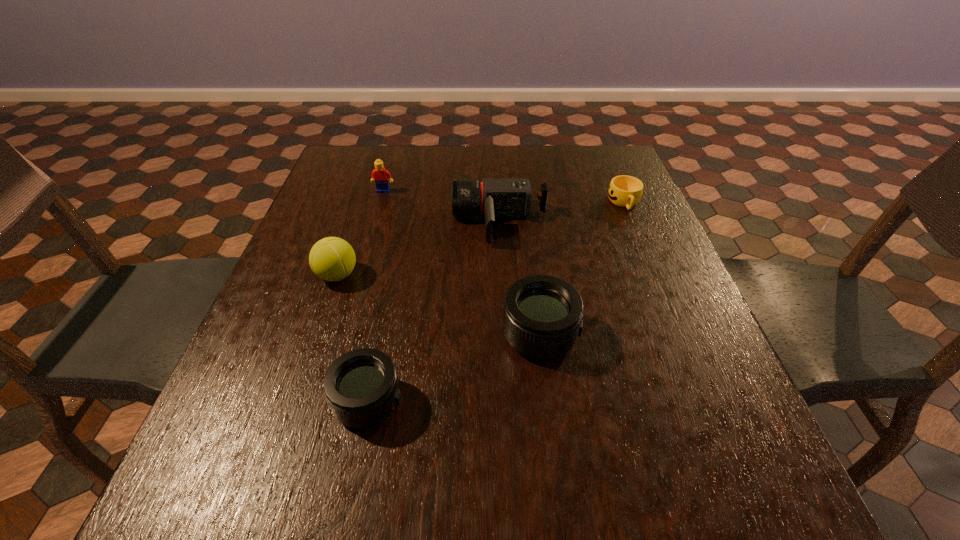
Find the location of a particular element. The width and height of the screenshot is (960, 540). the left telephoto lens is located at coordinates (361, 386).

Find the location of `the second shortest object`. the second shortest object is located at coordinates (361, 386).

Locate an element on the screen. The image size is (960, 540). the farther telephoto lens is located at coordinates (542, 319).

The width and height of the screenshot is (960, 540). Identify the location of the second nearest object. (542, 319).

I want to click on camcorder, so click(x=494, y=197).

The height and width of the screenshot is (540, 960). I want to click on Lego, so click(x=380, y=175).

Where is `the rightmost object`? the rightmost object is located at coordinates (624, 191).

Locate an element on the screen. The image size is (960, 540). cup is located at coordinates (624, 191).

Identify the location of tennis ball. This screenshot has width=960, height=540. (332, 259).

The width and height of the screenshot is (960, 540). Find the location of `blank space located 0.170m on the side of the left telephoto lens with brand markings and control switches`. blank space located 0.170m on the side of the left telephoto lens with brand markings and control switches is located at coordinates (502, 401).